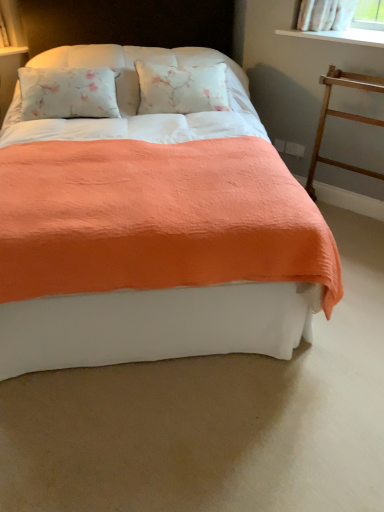
You are a GUI agent. You are given a task and a screenshot of the screen. Output one action in this format:
    pyautogui.click(x=<x>, y=<y>)
    Task: Click on the wooden at right
    
    Given the screenshot: What is the action you would take?
    pyautogui.click(x=342, y=118)

What do you see at coordinates (342, 118) in the screenshot? Image resolution: width=384 pixels, height=512 pixels. I see `wooden at right` at bounding box center [342, 118].

The width and height of the screenshot is (384, 512). What do you see at coordinates (341, 36) in the screenshot? I see `white smooth window sill at upper right` at bounding box center [341, 36].

What do you see at coordinates (153, 230) in the screenshot?
I see `coral fabric bed at center` at bounding box center [153, 230].

Image resolution: width=384 pixels, height=512 pixels. Identify the location of wooden at right. (342, 118).

Can white smooth window sill at upper right be found inside coral fabric bed at center?

No.

Can you tell me how much coral fabric bed at center and white smooth window sill at upper right differ in facing direction?

45.7 degrees separate the facing orientations of coral fabric bed at center and white smooth window sill at upper right.

Is coral fabric bed at center shorter than white smooth window sill at upper right?

No, coral fabric bed at center is not shorter than white smooth window sill at upper right.

Is wooden at right next to coral fabric bed at center?

There is a gap between wooden at right and coral fabric bed at center.

In the scene shown: Does wooden at right have a larger size compared to coral fabric bed at center?

Actually, wooden at right might be smaller than coral fabric bed at center.

Is wooden at right oriented towards coral fabric bed at center?

Yes, wooden at right faces towards coral fabric bed at center.

Who is taller, wooden at right or coral fabric bed at center?

coral fabric bed at center is taller.

Is white smooth window sill at upper right oriented towards coral fabric bed at center?

Yes, white smooth window sill at upper right faces towards coral fabric bed at center.

Can you confirm if white smooth window sill at upper right is positioned to the right of coral fabric bed at center?

Indeed, white smooth window sill at upper right is positioned on the right side of coral fabric bed at center.

Which object is wider, white smooth window sill at upper right or coral fabric bed at center?

coral fabric bed at center is wider.

Which object is further away from the camera, white smooth window sill at upper right or coral fabric bed at center?

white smooth window sill at upper right is further away from the camera.

From a real-world perspective, is white smooth window sill at upper right under wooden at right?

Actually, white smooth window sill at upper right is physically above wooden at right in the real world.

Which is behind, point (377, 36) or point (326, 115)?

The point (326, 115) is behind.

Is white smooth window sill at upper right outside of wooden at right?

white smooth window sill at upper right is positioned outside wooden at right.

Visually, is white smooth window sill at upper right positioned to the left or to the right of wooden at right?

In the image, white smooth window sill at upper right appears on the left side of wooden at right.

Is wooden at right next to white smooth window sill at upper right?

No, wooden at right is not with white smooth window sill at upper right.

Considering the sizes of objects wooden at right and white smooth window sill at upper right in the image provided, who is smaller, wooden at right or white smooth window sill at upper right?

With smaller size is white smooth window sill at upper right.

Is point (312, 164) farther from camera compared to point (354, 39)?

That is True.

Which is behind, wooden at right or white smooth window sill at upper right?

white smooth window sill at upper right is more distant.

Is coral fabric bed at center wider or thinner than wooden at right?

In the image, coral fabric bed at center appears to be wider than wooden at right.

Between coral fabric bed at center and wooden at right, which one appears on the left side from the viewer's perspective?

From the viewer's perspective, coral fabric bed at center appears more on the left side.

Does point (71, 279) come in front of point (339, 78)?

Yes, it is in front of point (339, 78).

How many degrees apart are the facing directions of coral fabric bed at center and wooden at right?

coral fabric bed at center and wooden at right are facing 45.7 degrees away from each other.

You are a GUI agent. You are given a task and a screenshot of the screen. Output one action in this format:
    pyautogui.click(x=<x>, y=<y>)
    Task: Click on the window sill behind the coral fabric bed at center
    The image size is (384, 512).
    Given the screenshot: What is the action you would take?
    pyautogui.click(x=341, y=36)

Where is `bed located above the wooden at right (from a real-world perspective)`? bed located above the wooden at right (from a real-world perspective) is located at coordinates (153, 230).

Considering their positions, is white smooth window sill at upper right positioned closer to coral fabric bed at center than wooden at right?

wooden at right is closer to coral fabric bed at center.

Looking at the image, which one is located further to wooden at right, white smooth window sill at upper right or coral fabric bed at center?

Based on the image, coral fabric bed at center appears to be further to wooden at right.

From the image, which object appears to be nearer to wooden at right, coral fabric bed at center or white smooth window sill at upper right?

white smooth window sill at upper right lies closer to wooden at right than the other object.

Estimate the real-world distances between objects in this image. Which object is further from white smooth window sill at upper right, coral fabric bed at center or wooden at right?

Among the two, coral fabric bed at center is located further to white smooth window sill at upper right.

Estimate the real-world distances between objects in this image. Which object is closer to white smooth window sill at upper right, wooden at right or coral fabric bed at center?

wooden at right is closer to white smooth window sill at upper right.

Based on their spatial positions, is wooden at right or white smooth window sill at upper right further from coral fabric bed at center?

Among the two, white smooth window sill at upper right is located further to coral fabric bed at center.

This screenshot has height=512, width=384. Identify the location of balustrade between coral fabric bed at center and white smooth window sill at upper right along the z-axis. (342, 118).